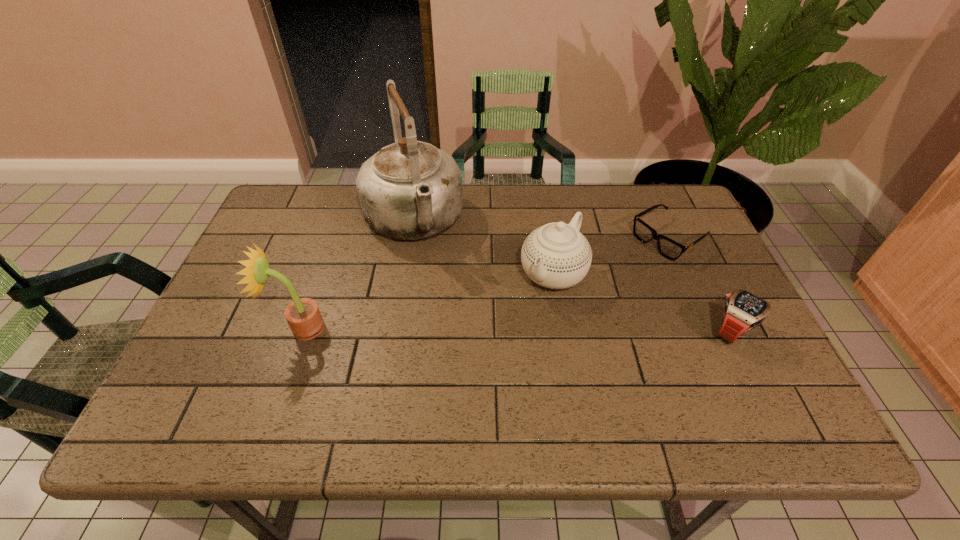
Locate an element on the screen. The image size is (960, 540). sunflower is located at coordinates coord(303,315).

This screenshot has width=960, height=540. What are the coordinates of `the leftmost object` in the screenshot? It's located at (303, 315).

Image resolution: width=960 pixels, height=540 pixels. In order to click on the fourth tallest object in this screenshot , I will do `click(743, 311)`.

I want to click on the third tallest object, so click(x=557, y=256).

The height and width of the screenshot is (540, 960). Find the location of `the third object from left to right`. the third object from left to right is located at coordinates (557, 256).

Where is `the fourth object from right to left`? The height and width of the screenshot is (540, 960). the fourth object from right to left is located at coordinates coord(409,190).

Find the location of `kettle`. kettle is located at coordinates (409, 190).

Find the location of a particular element. The width and height of the screenshot is (960, 540). the shortest object is located at coordinates (670, 249).

The height and width of the screenshot is (540, 960). Identify the location of blank space located 0.100m on the face of the second tallest object. (237, 328).

You are a GUI agent. You are given a task and a screenshot of the screen. Output one action in this format:
    pyautogui.click(x=<x>, y=<y>)
    Task: Click on the free spot located 0.070m on the face of the second tallest object
    
    Given the screenshot: What is the action you would take?
    pyautogui.click(x=250, y=328)